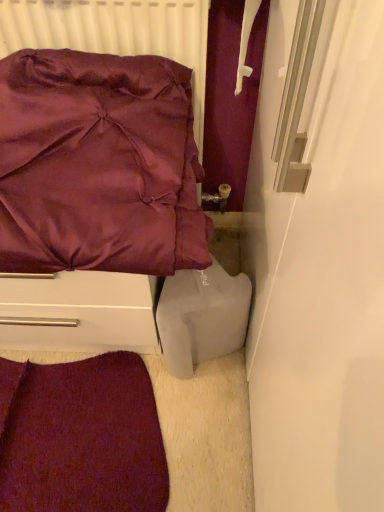
The height and width of the screenshot is (512, 384). What are the coordinates of `free space above velvet carpet at lower left (from a real-world perspective)` in the screenshot? It's located at (72, 428).